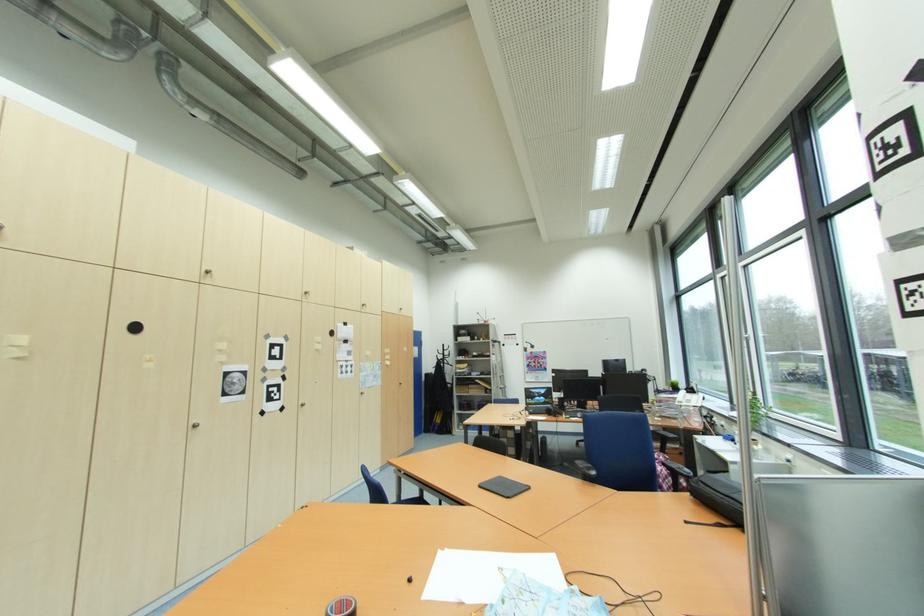
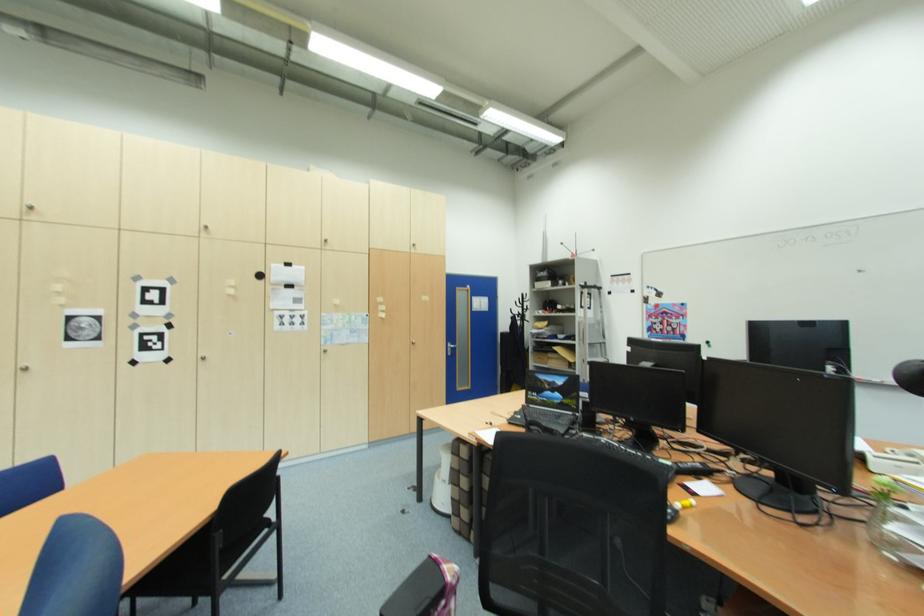
The point at (366, 392) is marked in the first image. Where is the corresponding point in the second image?

(327, 349)